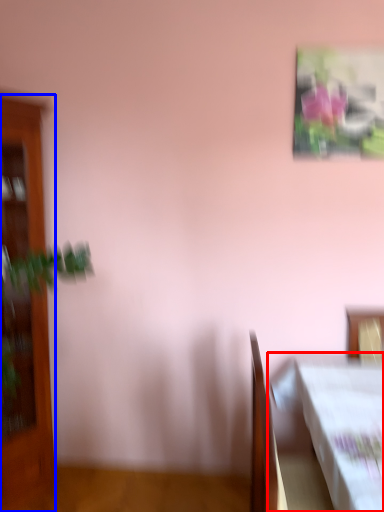
Question: Among these objects, which one is farthest to the camera, table (highlighted by a red box) or furniture (highlighted by a blue box)?

Choices:
 (A) table
 (B) furniture

Answer: (B)